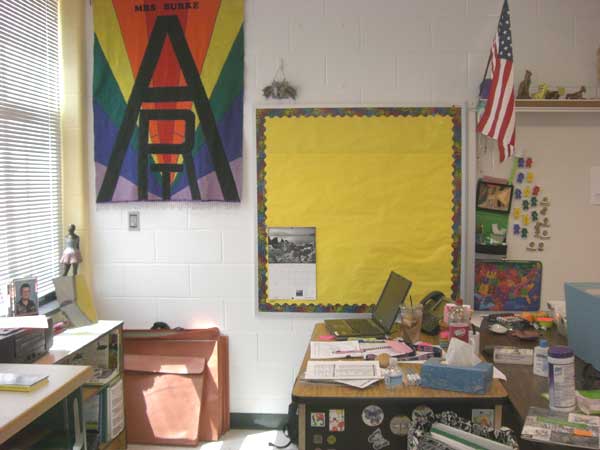
Find the location of a particular element. The image size is (600, 450). lysol wipes is located at coordinates (561, 383).